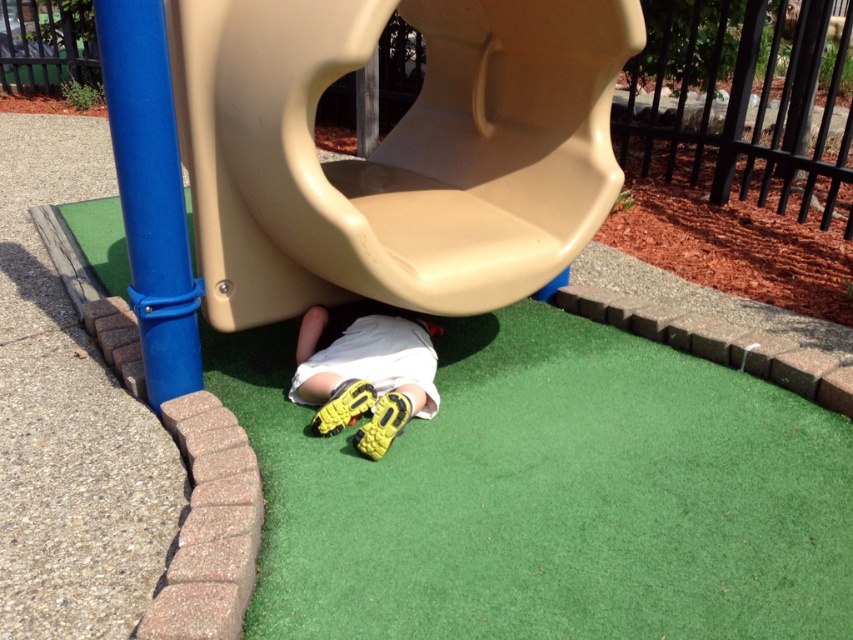
From the picture: Who is lower down, tan plastic slide at center or yellow rubber shoes at lower center?

yellow rubber shoes at lower center

At what (x,y) coordinates should I click in order to perform the action: click on tan plastic slide at center. Please return your answer as a coordinate pair (x, y). This screenshot has width=853, height=640. Looking at the image, I should click on (395, 150).

Where is `green artificial turf at lower center`? The height and width of the screenshot is (640, 853). green artificial turf at lower center is located at coordinates (x=548, y=493).

Looking at this image, is green artificial turf at lower center positioned behind yellow rubber shoes at lower center?

No, it is not.

This screenshot has height=640, width=853. What are the coordinates of `green artificial turf at lower center` in the screenshot? It's located at (548, 493).

Can you confirm if green artificial turf at lower center is wider than tan plastic slide at center?

Indeed, green artificial turf at lower center has a greater width compared to tan plastic slide at center.

Is green artificial turf at lower center smaller than tan plastic slide at center?

Indeed, green artificial turf at lower center has a smaller size compared to tan plastic slide at center.

The image size is (853, 640). In order to click on green artificial turf at lower center in this screenshot , I will do `click(548, 493)`.